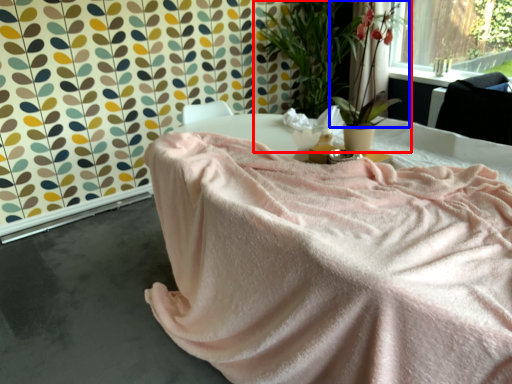
Question: Which object appears closest to the camera in this image, houseplant (highlighted by a red box) or floral arrangement (highlighted by a blue box)?

Choices:
 (A) houseplant
 (B) floral arrangement

Answer: (A)